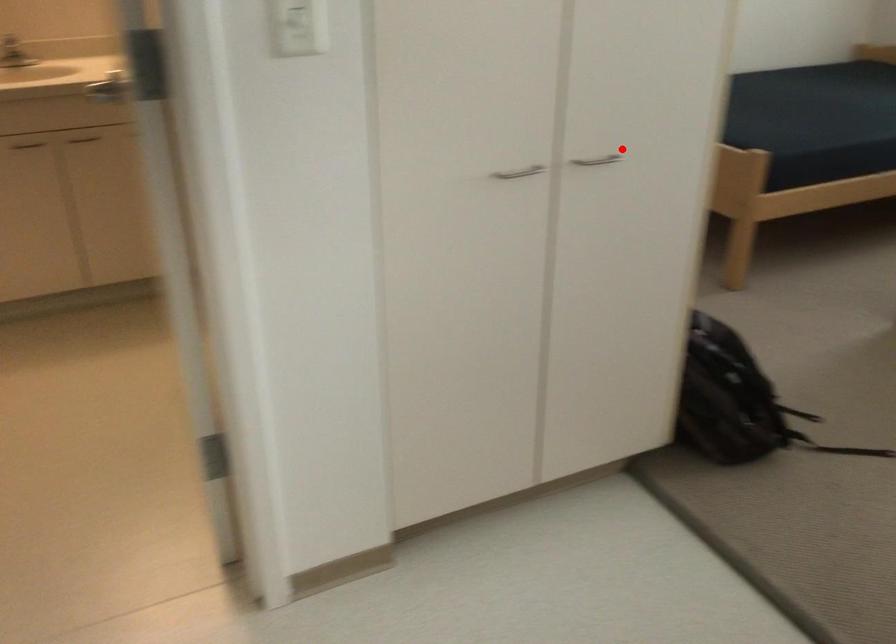
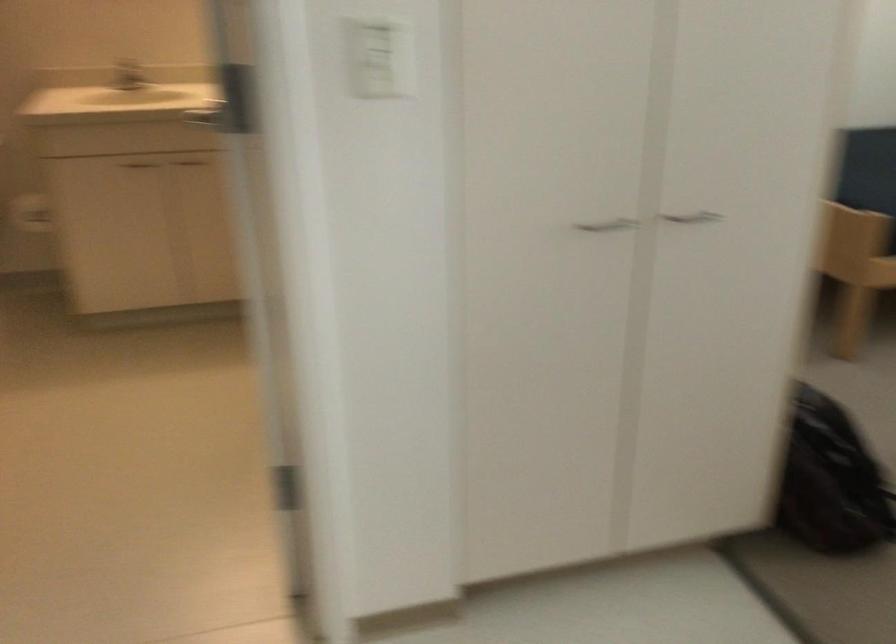
Find the pixel in the second image that matches the highlighted location in the first image.

(724, 205)